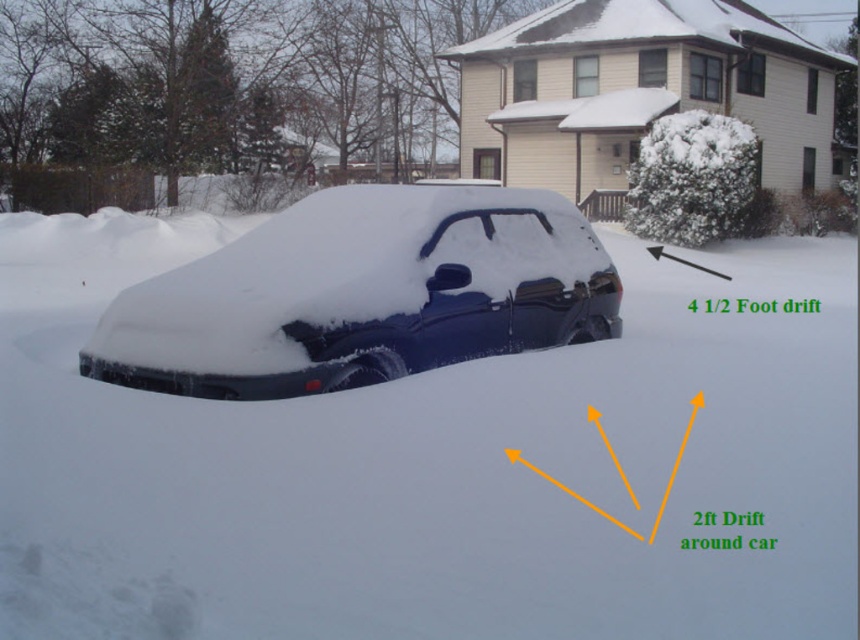
Question: Is white fluffy snow at center above matte blue car at center?

Choices:
 (A) no
 (B) yes

Answer: (B)

Question: Does white fluffy snow at center appear on the right side of matte blue car at center?

Choices:
 (A) yes
 (B) no

Answer: (B)

Question: Which point is closer to the camera?

Choices:
 (A) (599, 243)
 (B) (226, 508)

Answer: (B)

Question: Observing the image, what is the correct spatial positioning of white fluffy snow at center in reference to matte blue car at center?

Choices:
 (A) below
 (B) above

Answer: (B)

Question: Among these objects, which one is farthest from the camera?

Choices:
 (A) white fluffy snow at center
 (B) matte blue car at center

Answer: (B)

Question: Among these points, which one is farthest from the camera?

Choices:
 (A) (397, 330)
 (B) (126, 540)

Answer: (A)